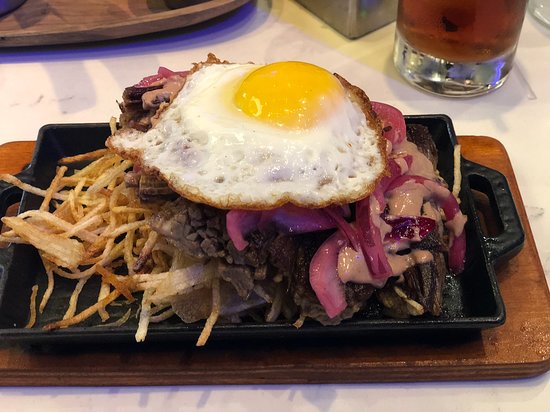
Identify the location of wooden centerpiece. This screenshot has height=412, width=550. (117, 12).